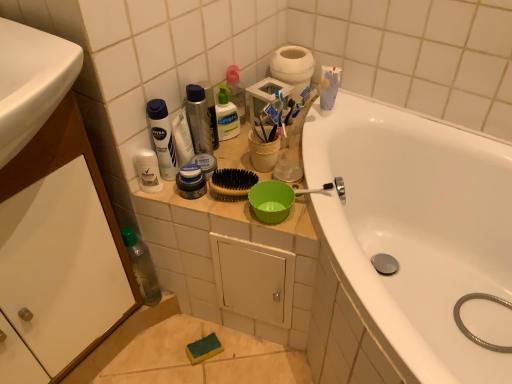
The image size is (512, 384). Identify the location of vacant area that is in front of clear plastic bottle at upper center, the 2th cleaning product in the right-to-left sequence. (227, 160).